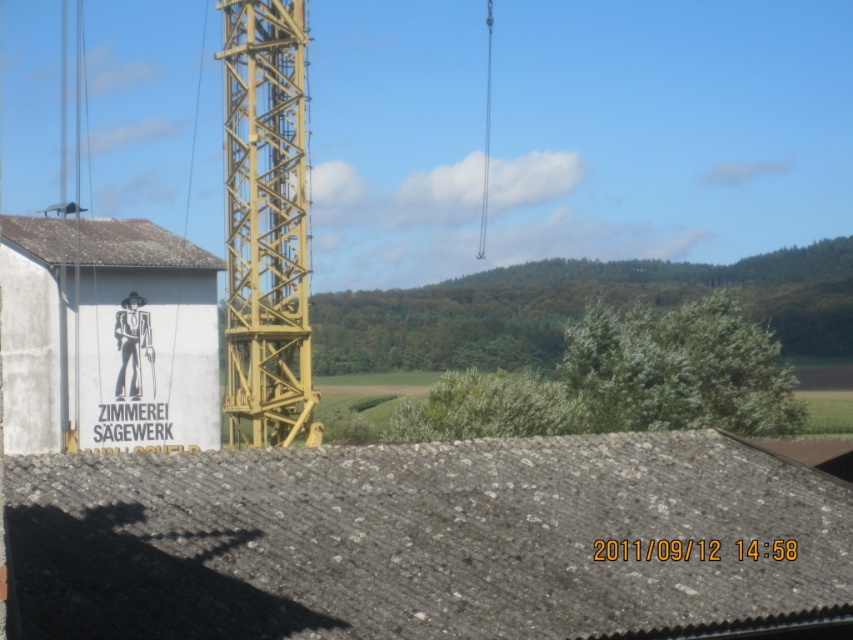
Question: Can you confirm if yellow metallic crane at center is wider than black matte figure at center?

Choices:
 (A) yes
 (B) no

Answer: (A)

Question: Is yellow metallic crane at center wider than white shingle roof at left?

Choices:
 (A) no
 (B) yes

Answer: (A)

Question: Does gray slate roof at center have a smaller size compared to white shingle roof at left?

Choices:
 (A) yes
 (B) no

Answer: (B)

Question: Which object is positioned closest to the white shingle roof at left?

Choices:
 (A) black matte figure at center
 (B) yellow metallic crane at center
 (C) gray slate roof at center

Answer: (A)

Question: Which object appears closest to the camera in this image?

Choices:
 (A) black matte figure at center
 (B) white shingle roof at left

Answer: (B)

Question: Which point is closer to the camera?

Choices:
 (A) black matte figure at center
 (B) yellow metallic crane at center
 (C) gray slate roof at center
 (D) white shingle roof at left

Answer: (C)